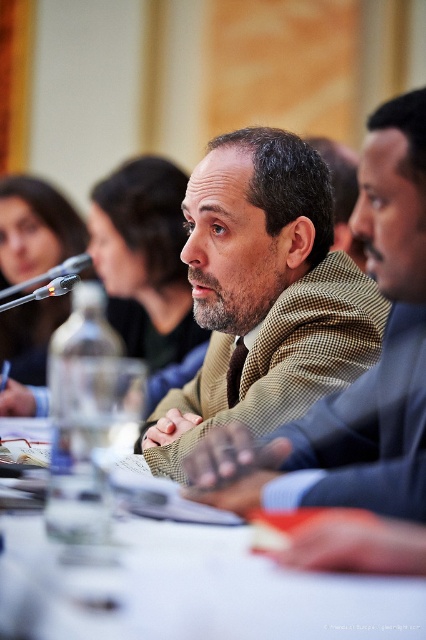
Does green checkered blazer at center appear under white glossy table at center?

Incorrect, green checkered blazer at center is not positioned below white glossy table at center.

Between point (207, 179) and point (316, 625), which one is positioned in front?

Point (316, 625) is more forward.

This screenshot has height=640, width=426. Find the location of `green checkered blazer at center`. green checkered blazer at center is located at coordinates (264, 292).

Identify the location of green checkered blazer at center. The image size is (426, 640). point(264,292).